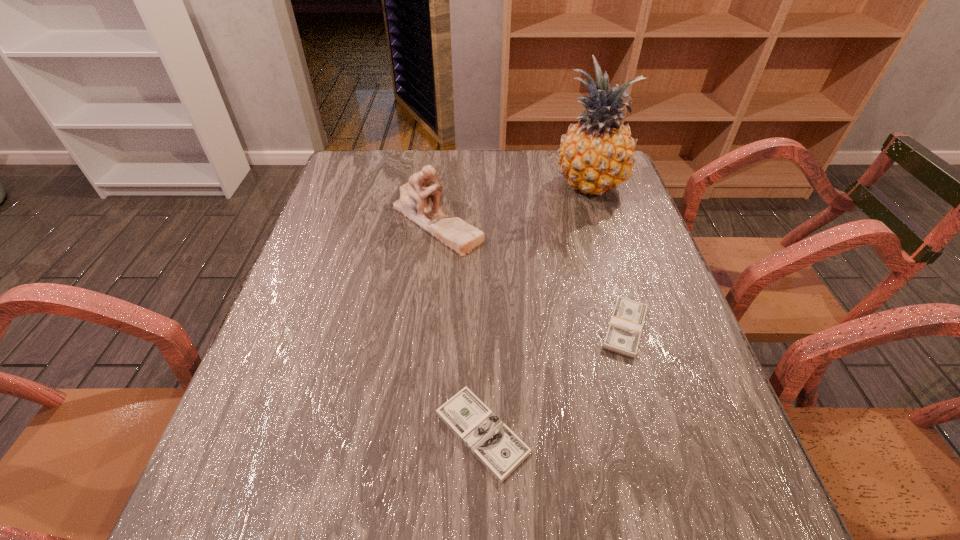
Locate an element on the screen. blank space that satisfies the following two spatial constraints: 1. on the front-facing side of the figurine; 2. on the right side of the third farthest object is located at coordinates (424, 328).

This screenshot has height=540, width=960. What are the coordinates of `vacant space that satisfies the following two spatial constraints: 1. on the back side of the second shortest object; 2. on the left side of the left dollar` in the screenshot? It's located at (482, 328).